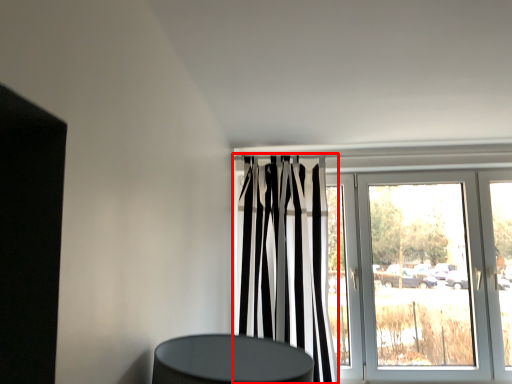
Question: From the image's perspective, what is the correct spatial positioning of curtain (annotated by the red box) in reference to door?

Choices:
 (A) below
 (B) above

Answer: (B)